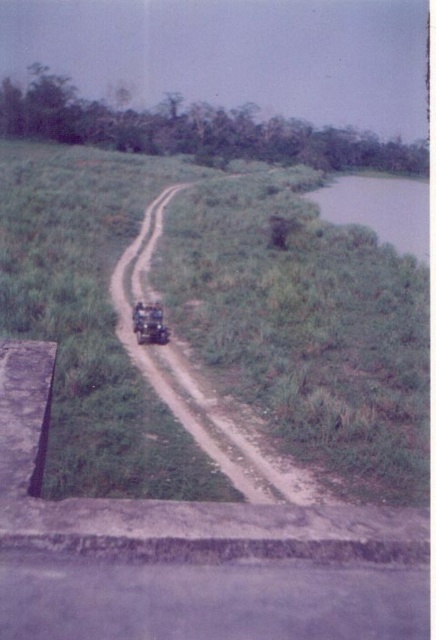
Question: Does brown dirt track at center have a lesser width compared to metallic matte jeep at center?

Choices:
 (A) no
 (B) yes

Answer: (A)

Question: Among these objects, which one is farthest from the camera?

Choices:
 (A) metallic matte jeep at center
 (B) brown dirt track at center

Answer: (A)

Question: Is brown dirt track at center bigger than metallic matte jeep at center?

Choices:
 (A) no
 (B) yes

Answer: (B)

Question: Among these points, which one is nearest to the camera?

Choices:
 (A) (133, 324)
 (B) (188, 433)

Answer: (B)

Question: Does brown dirt track at center appear on the right side of metallic matte jeep at center?

Choices:
 (A) no
 (B) yes

Answer: (A)